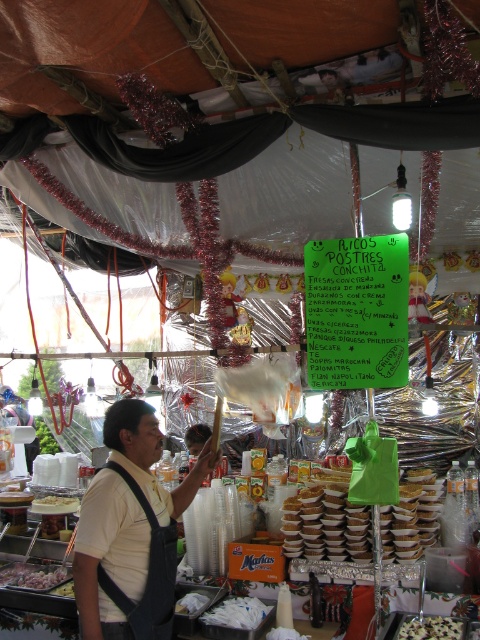
You are a customer at the food stall and want to grab both the white glossy onion at lower left and the white matte cupcake at center. Which item should you reach for first if you want to pick up the lower one first?

The white glossy onion at lower left is below the white matte cupcake at center, so you should reach for the white glossy onion at lower left first.

You are a customer at the food stall and you want to choose a container to hold a beverage. The white paper cups at center and the white glossy onion at lower left are both available. Which one has a bigger capacity?

The white paper cups at center has a larger size compared to the white glossy onion at lower left, so it has a bigger capacity.